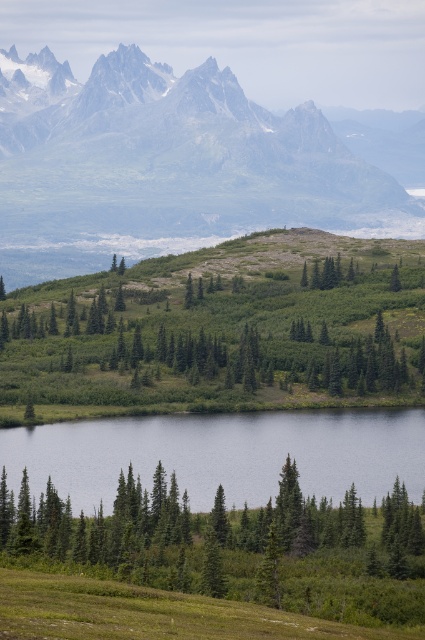
Question: Considering the relative positions of gray rocky mountain range at upper left and smooth reflective water at lower center in the image provided, where is gray rocky mountain range at upper left located with respect to smooth reflective water at lower center?

Choices:
 (A) right
 (B) left

Answer: (B)

Question: Among these objects, which one is nearest to the camera?

Choices:
 (A) green matte tree at center
 (B) gray rocky mountain range at upper left
 (C) smooth reflective water at lower center
 (D) green matte tree at lower left

Answer: (D)

Question: Estimate the real-world distances between objects in this image. Which object is closer to the green matte tree at lower left?

Choices:
 (A) green matte tree at center
 (B) gray rocky mountain range at upper left
 (C) smooth reflective water at lower center

Answer: (C)

Question: Does green matte tree at center come in front of gray rocky mountain range at upper left?

Choices:
 (A) yes
 (B) no

Answer: (A)

Question: Does green matte tree at center have a lesser width compared to gray rocky mountain range at upper left?

Choices:
 (A) no
 (B) yes

Answer: (B)

Question: Which of the following is the farthest from the observer?

Choices:
 (A) coord(189,189)
 (B) coord(138,545)
 (C) coord(153,461)

Answer: (A)